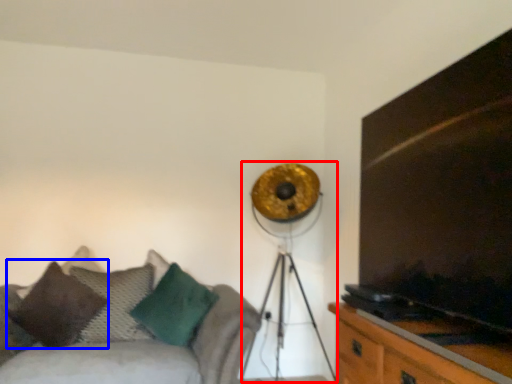
Question: Which object is further to the camera taking this photo, lamp (highlighted by a red box) or pillow (highlighted by a blue box)?

Choices:
 (A) lamp
 (B) pillow

Answer: (B)